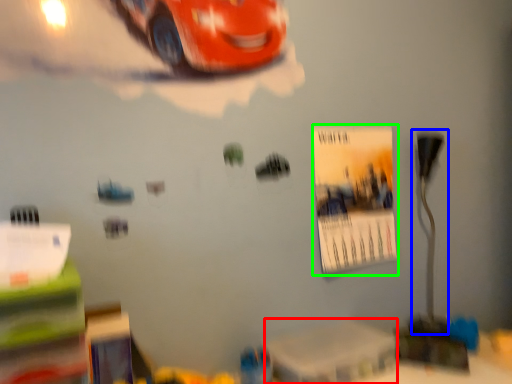
Question: Which object is the farthest from table (highlighted by a red box)? Choose among these: table lamp (highlighted by a blue box) or poster page (highlighted by a green box).

Choices:
 (A) table lamp
 (B) poster page

Answer: (A)